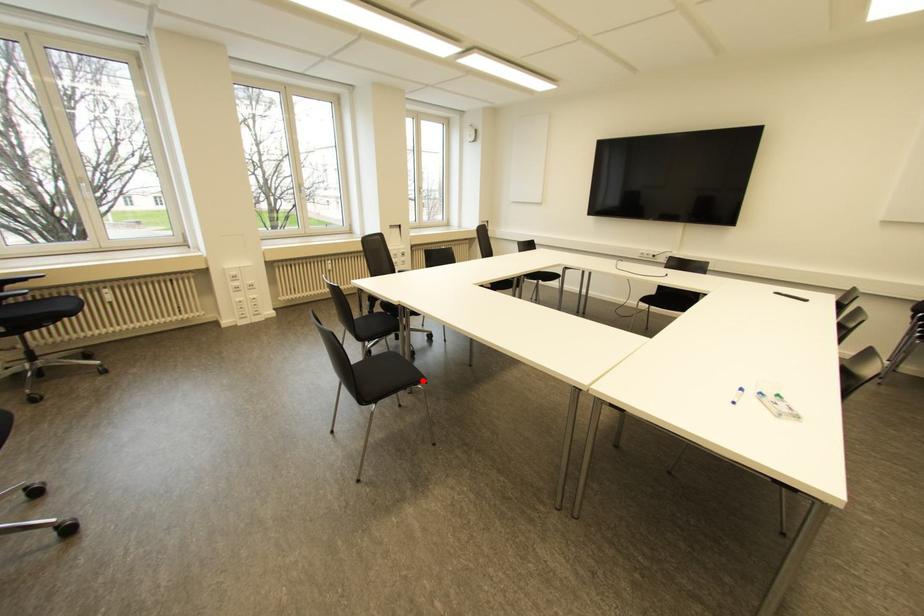
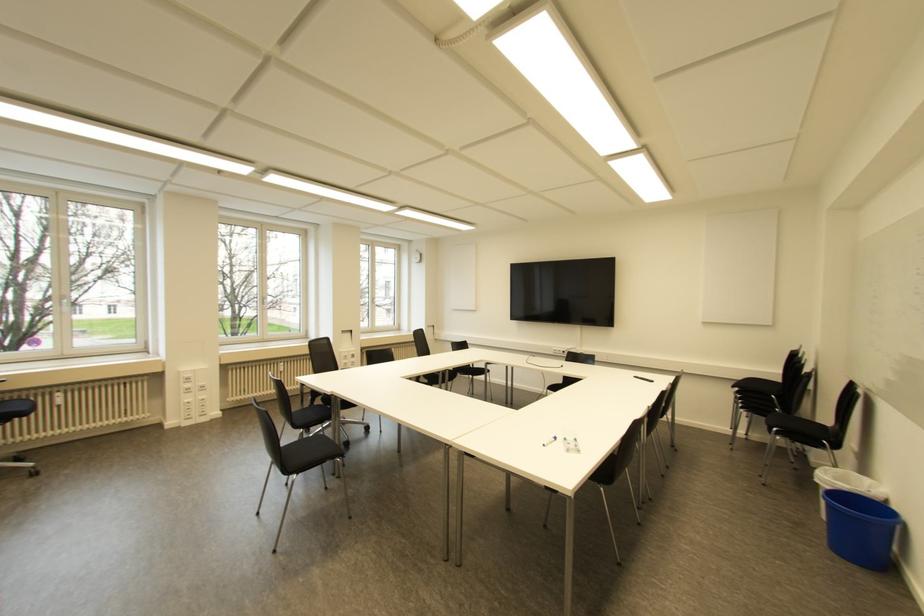
In the second image, find the point that corresponds to the highlighted location in the first image.

(342, 455)